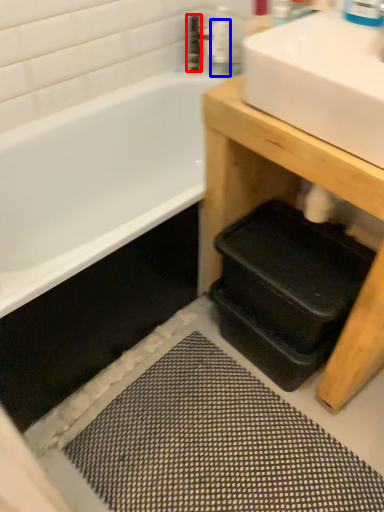
Question: Which point is closer to the camera, toiletry (highlighted by a red box) or toiletry (highlighted by a blue box)?

Choices:
 (A) toiletry
 (B) toiletry

Answer: (B)